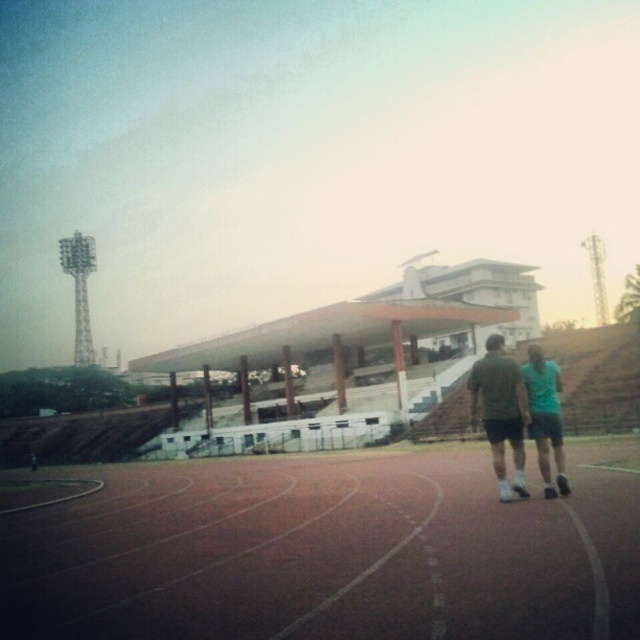
Is brown rubber track at center smaller than dark gray shorts at center?

Yes.

This screenshot has width=640, height=640. What do you see at coordinates (330, 552) in the screenshot? I see `brown rubber track at center` at bounding box center [330, 552].

Which is in front, point (561, 536) or point (508, 374)?

Point (561, 536) is in front.

Locate an element on the screen. The height and width of the screenshot is (640, 640). brown rubber track at center is located at coordinates (330, 552).

Between dark gray shorts at center and teal fabric shorts at right, which one has more height?

dark gray shorts at center is taller.

Between point (499, 384) and point (560, 429), which one is positioned behind?

Positioned behind is point (560, 429).

You are a GUI agent. You are given a task and a screenshot of the screen. Output one action in this format:
    pyautogui.click(x=<x>, y=<y>)
    Task: Click on the dark gray shorts at center
    The image size is (640, 640).
    Given the screenshot: What is the action you would take?
    pyautogui.click(x=500, y=412)

The height and width of the screenshot is (640, 640). What do you see at coordinates (330, 552) in the screenshot? I see `brown rubber track at center` at bounding box center [330, 552].

Can you confirm if brown rubber track at center is smaller than teal fabric shorts at right?

Correct, brown rubber track at center occupies less space than teal fabric shorts at right.

Is point (403, 634) more distant than point (545, 372)?

That is False.

I want to click on brown rubber track at center, so click(330, 552).